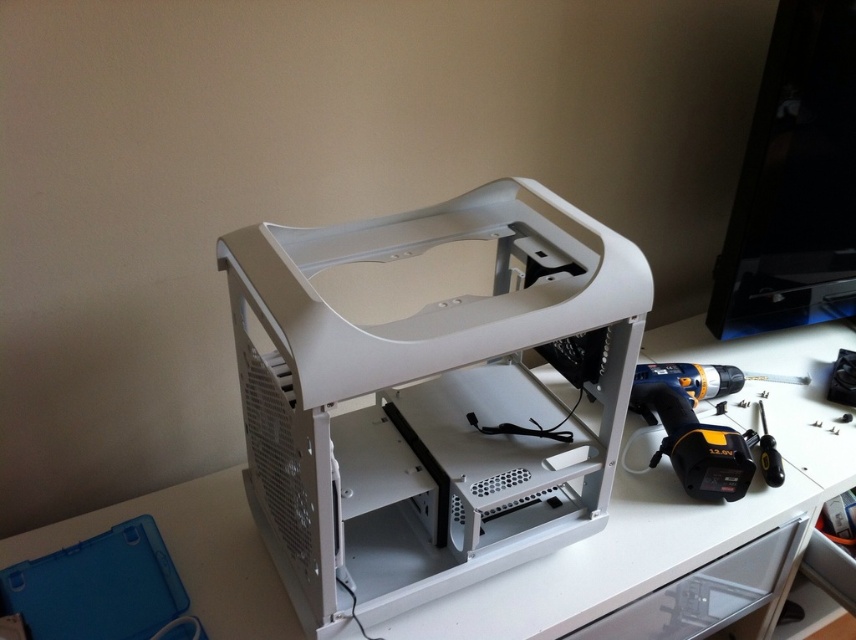
Is white plastic computer case at center positioned at the back of yellow/black plastic drill at right?

No, it is not.

Between white plastic computer case at center and yellow/black plastic drill at right, which one has less height?

Standing shorter between the two is yellow/black plastic drill at right.

Between point (437, 518) and point (726, 445), which one is positioned in front?

Point (437, 518) is in front.

You are a GUI agent. You are given a task and a screenshot of the screen. Output one action in this format:
    pyautogui.click(x=<x>, y=<y>)
    Task: Click on the white plastic computer case at center
    The image size is (856, 640).
    Given the screenshot: What is the action you would take?
    pyautogui.click(x=428, y=403)

Who is positioned more to the right, white plastic computer case at center or white plastic table at center?

Positioned to the right is white plastic table at center.

Is point (619, 269) in front of point (759, 337)?

Yes.

This screenshot has height=640, width=856. Find the location of `white plastic computer case at center`. white plastic computer case at center is located at coordinates (428, 403).

Find the location of a particular element. white plastic table at center is located at coordinates (670, 506).

Between point (210, 509) and point (658, 592), which one is positioned in front?

Positioned in front is point (658, 592).

Is point (491, 579) farther from viewer compared to point (709, 598)?

No, (491, 579) is in front of (709, 598).

Find the location of a particular element. The width and height of the screenshot is (856, 640). white plastic table at center is located at coordinates (670, 506).